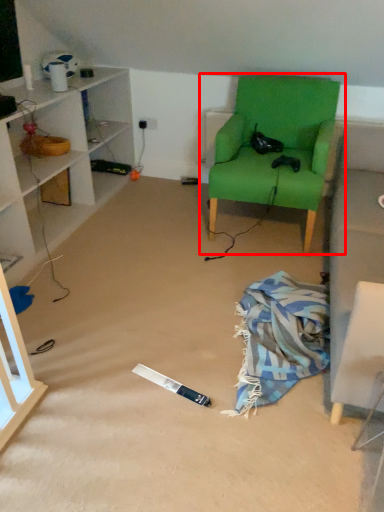
Question: From the image, what is the correct spatial relationship of chair (annotated by the red box) in relation to blanket?

Choices:
 (A) right
 (B) left

Answer: (A)